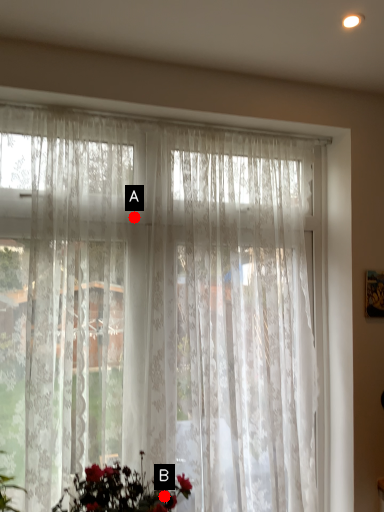
Question: Two points are circled on the image, labeled by A and B beside each circle. Which point is farther from the camera taking this photo?

Choices:
 (A) A is further
 (B) B is further

Answer: (A)